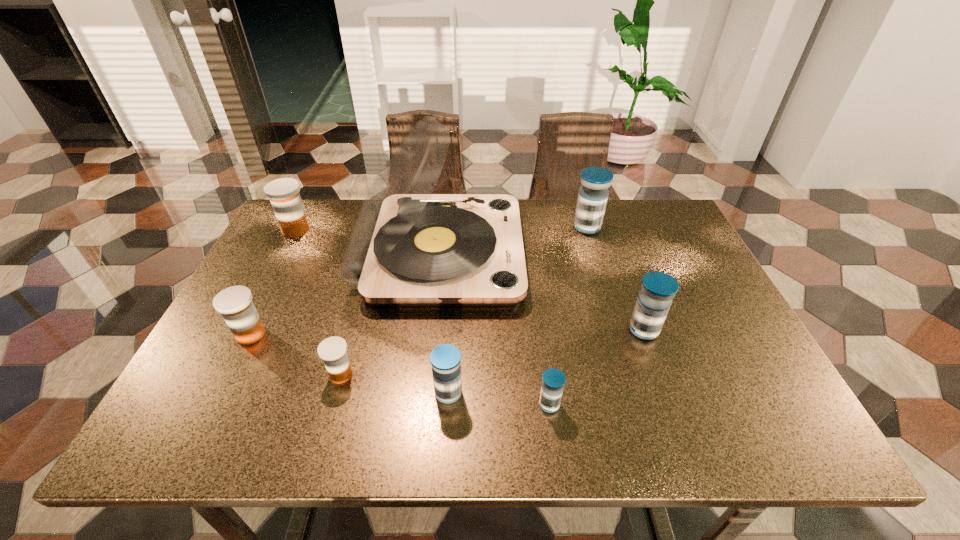
Where is `vacant area in the image that satisfies the following two spatial constraints: 1. with the tonearm facing the front of the record player; 2. on the label of the smallest orange medicine`? vacant area in the image that satisfies the following two spatial constraints: 1. with the tonearm facing the front of the record player; 2. on the label of the smallest orange medicine is located at coordinates (428, 374).

Identify the location of vacant region that satisfies the following two spatial constraints: 1. on the back side of the seventh shortest object; 2. on the right side of the smallest blue medicine. (526, 227).